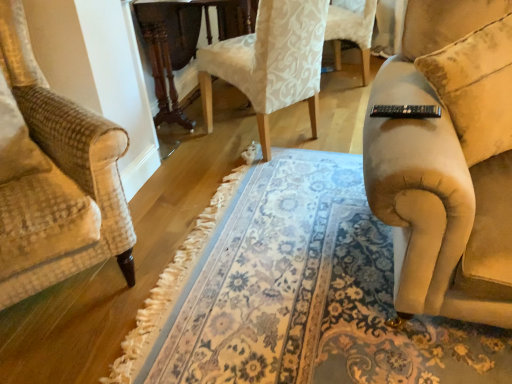
Where is `beige fabric couch at right`? This screenshot has width=512, height=384. beige fabric couch at right is located at coordinates (448, 160).

Between beige fabric couch at right and floral carpet at center, which one has smaller width?

With smaller width is beige fabric couch at right.

Consider the image. Which is closer, (498,284) or (351,320)?

Point (498,284) is positioned closer to the camera compared to point (351,320).

Is beige fabric couch at right bigger than floral carpet at center?

Actually, beige fabric couch at right might be smaller than floral carpet at center.

From a real-world perspective, is dark wood round table at center beneath floral carpet at center?

No.

What are the coordinates of `mat beneath the dark wood round table at center (from a real-world perspective)` in the screenshot? It's located at (295, 292).

Is beige fabric couch at right at the right side of dark wood round table at center?

Yes, beige fabric couch at right is to the right of dark wood round table at center.

Who is shorter, beige fabric couch at right or dark wood round table at center?

With less height is beige fabric couch at right.

From the image's perspective, which one is positioned lower, beige fabric couch at right or dark wood round table at center?

beige fabric couch at right is shown below in the image.

Identify the location of studio couch on the right of dark wood round table at center. This screenshot has height=384, width=512. (448, 160).

How different are the orientations of floral carpet at center and white damask fabric chair at center in degrees?

144 degrees.

Considering the sizes of objects floral carpet at center and white damask fabric chair at center in the image provided, who is smaller, floral carpet at center or white damask fabric chair at center?

floral carpet at center is smaller.

From a real-world perspective, who is located lower, floral carpet at center or white damask fabric chair at center?

From a 3D spatial view, floral carpet at center is below.

Does floral carpet at center have a greater width compared to white damask fabric chair at center?

Correct, the width of floral carpet at center exceeds that of white damask fabric chair at center.

From a real-world perspective, is white damask fabric chair at center above or below floral carpet at center?

From a real-world perspective, white damask fabric chair at center is physically above floral carpet at center.

Considering the sizes of objects white damask fabric chair at center and floral carpet at center in the image provided, who is taller, white damask fabric chair at center or floral carpet at center?

With more height is white damask fabric chair at center.

Is white damask fabric chair at center further to camera compared to floral carpet at center?

Yes, the depth of white damask fabric chair at center is greater than that of floral carpet at center.

How far apart are white damask fabric chair at center and floral carpet at center?

They are 81.87 centimeters apart.

You are a GUI agent. You are given a task and a screenshot of the screen. Output one action in this format:
    pyautogui.click(x=<x>, y=<y>)
    Task: Click on the round table behind the beige fabric couch at right
    
    Given the screenshot: What is the action you would take?
    pyautogui.click(x=183, y=42)

Does dark wood round table at center have a greater width compared to beige fabric couch at right?

Indeed, dark wood round table at center has a greater width compared to beige fabric couch at right.

Is the depth of dark wood round table at center less than that of beige fabric couch at right?

No, it is not.

Does dark wood round table at center contain beige fabric couch at right?

Definitely not — beige fabric couch at right is not inside dark wood round table at center.

Considering the relative sizes of beige fabric couch at right and white damask fabric chair at center in the image provided, is beige fabric couch at right thinner than white damask fabric chair at center?

Indeed, beige fabric couch at right has a lesser width compared to white damask fabric chair at center.

Find the location of `studio couch located above the white damask fabric chair at center (from a real-world perspective)`. studio couch located above the white damask fabric chair at center (from a real-world perspective) is located at coordinates [x=448, y=160].

What's the angular difference between beige fabric couch at right and white damask fabric chair at center's facing directions?

The facing directions of beige fabric couch at right and white damask fabric chair at center are 170 degrees apart.

Identify the location of mat that appears on the left of beige fabric couch at right. This screenshot has width=512, height=384. (295, 292).

This screenshot has height=384, width=512. I want to click on round table behind the floral carpet at center, so click(x=183, y=42).

From the image, which object appears to be farther from floral carpet at center, white damask fabric chair at center or dark wood round table at center?

dark wood round table at center is positioned further to the anchor floral carpet at center.

Based on their spatial positions, is floral carpet at center or white damask fabric chair at center closer to beige fabric couch at right?

floral carpet at center is positioned closer to the anchor beige fabric couch at right.

Estimate the real-world distances between objects in this image. Which object is closer to white damask fabric chair at center, dark wood round table at center or beige fabric couch at right?

Among the two, dark wood round table at center is located nearer to white damask fabric chair at center.

From the image, which object appears to be farther from white damask fabric chair at center, dark wood round table at center or floral carpet at center?

Based on the image, floral carpet at center appears to be further to white damask fabric chair at center.

Which object lies nearer to the anchor point white damask fabric chair at center, beige fabric couch at right or floral carpet at center?

Among the two, floral carpet at center is located nearer to white damask fabric chair at center.

When comparing their distances from floral carpet at center, does white damask fabric chair at center or beige fabric couch at right seem further?

The object further to floral carpet at center is white damask fabric chair at center.

In the scene shown: Estimate the real-world distances between objects in this image. Which object is further from dark wood round table at center, floral carpet at center or white damask fabric chair at center?

floral carpet at center.

In the scene shown: Based on their spatial positions, is dark wood round table at center or white damask fabric chair at center closer to beige fabric couch at right?

white damask fabric chair at center.

This screenshot has height=384, width=512. Identify the location of chair that lies between dark wood round table at center and floral carpet at center from top to bottom. (270, 62).

The width and height of the screenshot is (512, 384). What are the coordinates of `studio couch between floral carpet at center and dark wood round table at center along the z-axis` in the screenshot? It's located at (448, 160).

Find the location of a particular element. studio couch between white damask fabric chair at center and floral carpet at center vertically is located at coordinates (448, 160).

You are a GUI agent. You are given a task and a screenshot of the screen. Output one action in this format:
    pyautogui.click(x=<x>, y=<y>)
    Task: Click on the chair located between beige fabric couch at right and dark wood round table at center in the depth direction
    This screenshot has width=512, height=384.
    Given the screenshot: What is the action you would take?
    pyautogui.click(x=270, y=62)